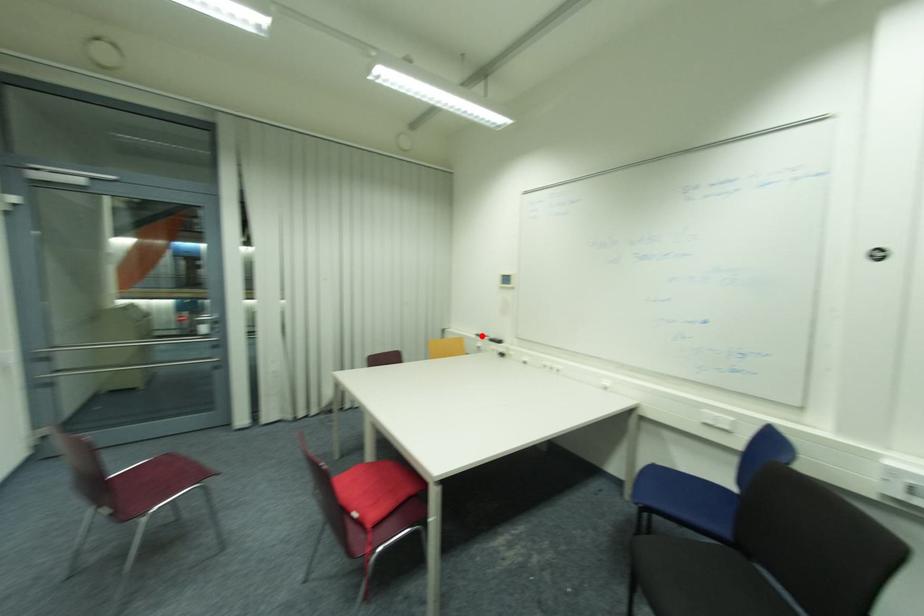
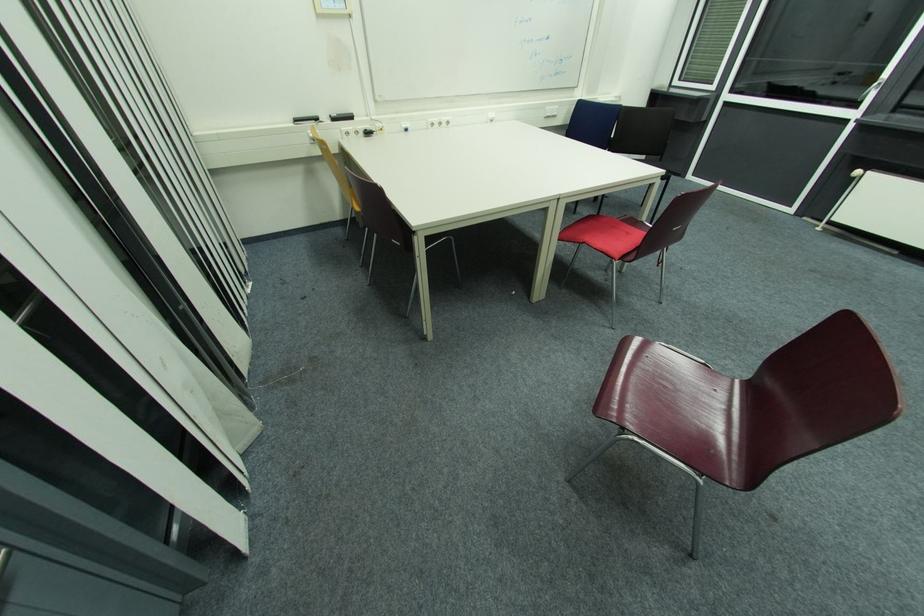
Question: I am providing you with two images of the same scene from different viewpoints. A red point is shown in image1. For the corresponding object point in image2, is it positioned nearer or farther from the camera?

Choices:
 (A) Nearer
 (B) Farther

Answer: (A)